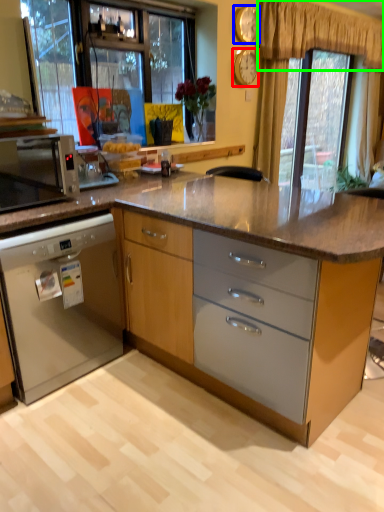
Question: Which object is positioned closest to clock (highlighted by a red box)? Select from clock (highlighted by a blue box) and curtain (highlighted by a green box).

Choices:
 (A) clock
 (B) curtain

Answer: (A)